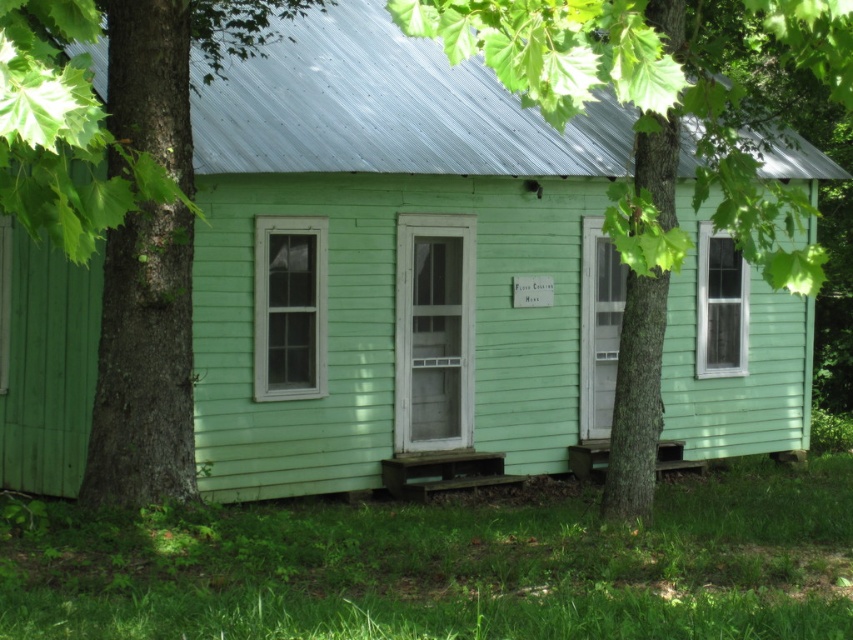
You are standing in front of the house and want to know which tree is taller between the green rough bark tree at left and the green wood tree at center. Can you tell me?

The green rough bark tree at left is not as tall as the green wood tree at center, so the green wood tree at center is taller.

You are standing at the front door of the house and want to walk to the green wood tree at center. There is a green rough bark tree at left blocking your path. Can you walk around it? Please explain your reasoning.

The distance between the green rough bark tree at left and the green wood tree at center is 5.64 meters. Since the trees are spaced apart, you can walk around the green rough bark tree at left to reach the green wood tree at center.